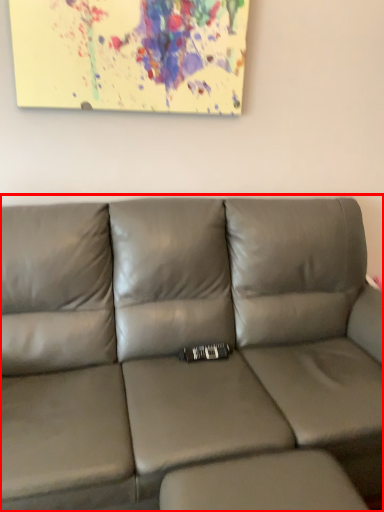
Question: From the image's perspective, where is studio couch (annotated by the red box) located in relation to footrest in the image?

Choices:
 (A) above
 (B) below

Answer: (A)